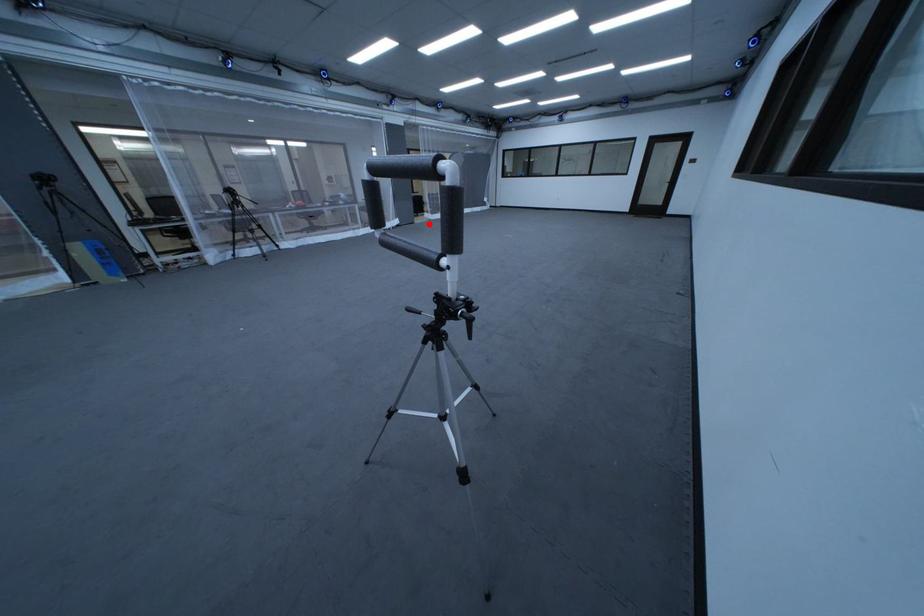
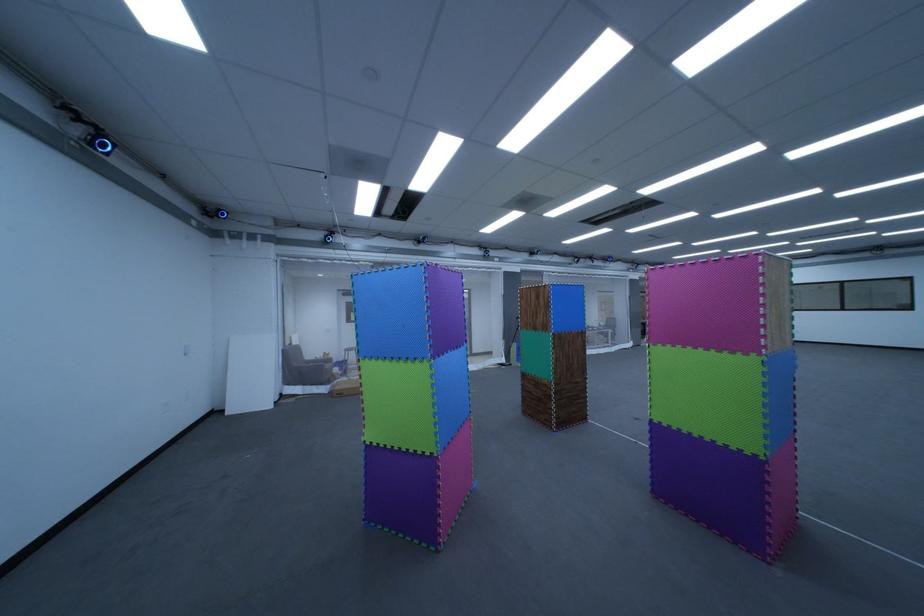
Question: I am providing you with two images of the same scene from different viewpoints. Image1 has a red point marked. In image2, the corresponding 3D location appears at what relative position? Reply with the corresponding letter.

Choices:
 (A) Closer
 (B) Farther

Answer: (A)